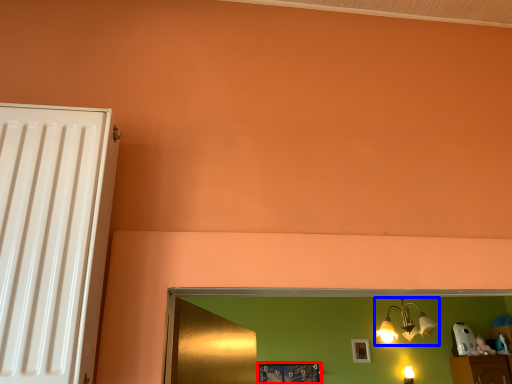
Question: Among these objects, which one is farthest to the camera, picture frame (highlighted by a red box) or lamp (highlighted by a blue box)?

Choices:
 (A) picture frame
 (B) lamp

Answer: (A)